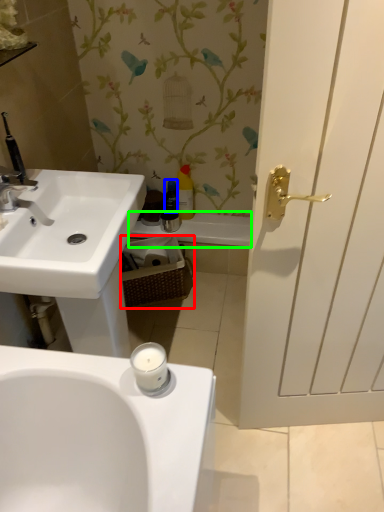
Question: Based on their relative distances, which object is farther from basket (highlighted by a red box)? Choose from toiletry (highlighted by a blue box) and bath (highlighted by a green box).

Choices:
 (A) toiletry
 (B) bath

Answer: (A)